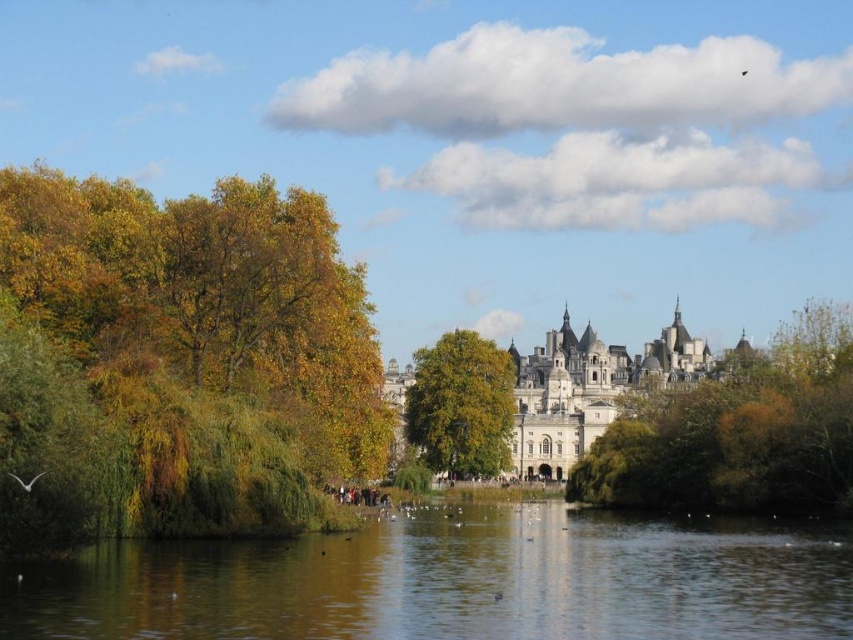
Question: Can you confirm if green reflective water at lower center is wider than golden textured tree at center?

Choices:
 (A) no
 (B) yes

Answer: (B)

Question: Which is nearer to the golden textured tree at center?

Choices:
 (A) white stone castle at center
 (B) green leafy tree at center
 (C) green reflective water at lower center

Answer: (A)

Question: Which of the following is the farthest from the observer?

Choices:
 (A) (622, 364)
 (B) (589, 461)

Answer: (A)

Question: Is green leafy tree at center closer to camera compared to white stone castle at center?

Choices:
 (A) yes
 (B) no

Answer: (A)

Question: Which object is positioned farthest from the green leafy tree at center?

Choices:
 (A) yellow-green leaves at left
 (B) green reflective water at lower center
 (C) white stone castle at center

Answer: (A)

Question: Where is yellow-green leaves at left located in relation to golden textured tree at center in the image?

Choices:
 (A) below
 (B) above

Answer: (B)